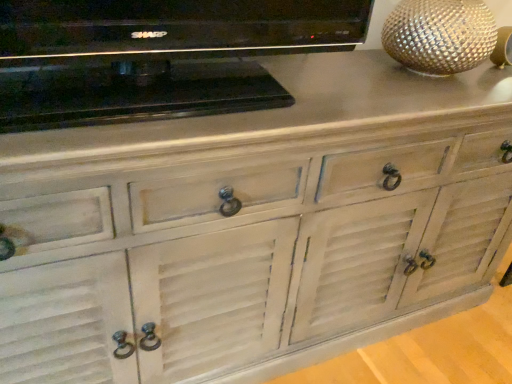
Find the location of `blank area beneath gold textured sphere at upper right (from a real-world perspective)`. blank area beneath gold textured sphere at upper right (from a real-world perspective) is located at coordinates (414, 77).